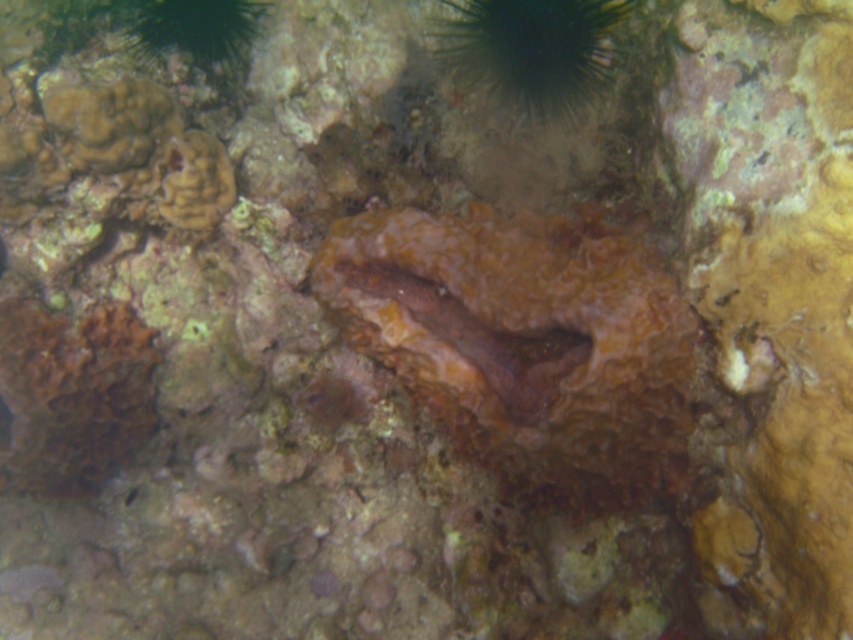
Question: Is brown rough coral at lower left bigger than green spiky sea urchin at upper center?

Choices:
 (A) yes
 (B) no

Answer: (A)

Question: Is orange sponge at center above green spiky sea urchin at upper center?

Choices:
 (A) yes
 (B) no

Answer: (B)

Question: Which point is closer to the camera?

Choices:
 (A) (10, 388)
 (B) (482, 51)

Answer: (B)

Question: Which point is closer to the camera?

Choices:
 (A) orange sponge at center
 (B) brown rough coral at lower left

Answer: (A)

Question: Which point is closer to the camera?

Choices:
 (A) orange sponge at center
 (B) brown rough coral at lower left

Answer: (A)

Question: Is orange sponge at center below brown rough coral at lower left?

Choices:
 (A) yes
 (B) no

Answer: (B)